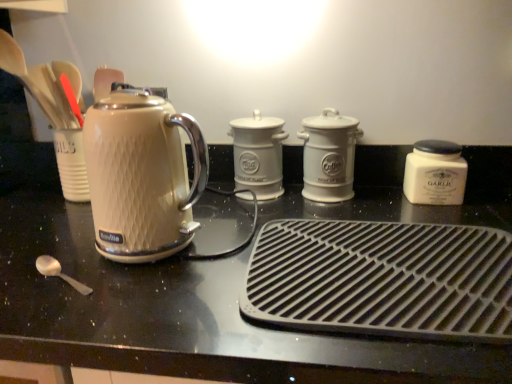
Where is `vacant space in front of white ceramic canister at center, arranged as the fourth kitchen appliance when viewed from the front`? vacant space in front of white ceramic canister at center, arranged as the fourth kitchen appliance when viewed from the front is located at coordinates (232, 219).